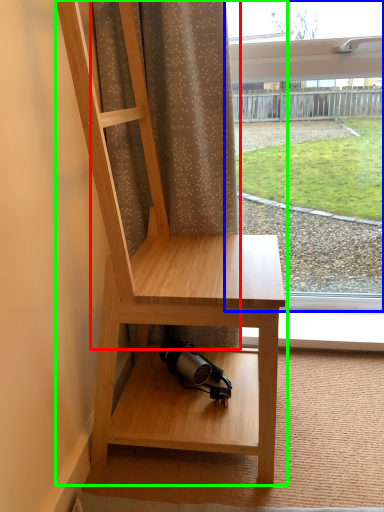
Question: Considering the real-world distances, which object is closest to curtain (highlighted by a red box)? window (highlighted by a blue box) or furniture (highlighted by a green box).

Choices:
 (A) window
 (B) furniture

Answer: (B)